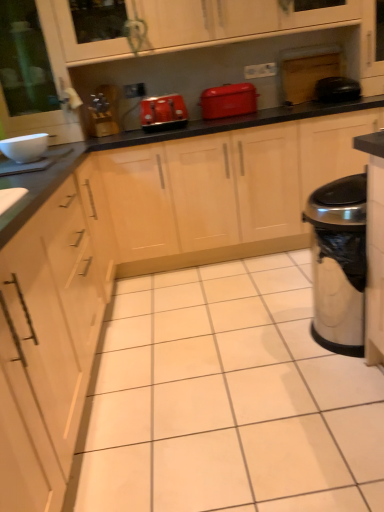
Question: Looking at their shapes, would you say matte wood cabinet at upper center is wider or thinner than black rubber trash can at right, positioned as the 2th appliance in left-to-right order?

Choices:
 (A) thin
 (B) wide

Answer: (B)

Question: Is point (314, 9) positioned closer to the camera than point (334, 96)?

Choices:
 (A) farther
 (B) closer

Answer: (B)

Question: Which object is positioned closest to the black rubber trash can at right, the first appliance viewed from the right?

Choices:
 (A) white glossy bowl at upper left, which appears as the second appliance when viewed from the back
 (B) black glossy countertop at center
 (C) silver metallic trash can at right
 (D) matte plastic toaster at center
 (E) matte wood cabinet at upper center

Answer: (B)

Question: Considering the real-world distances, which object is farthest from the matte wood cabinet at upper center?

Choices:
 (A) matte plastic toaster at center
 (B) matte red toaster at center
 (C) silver metallic trash can at right
 (D) white glossy bowl at upper left, which ranks as the second appliance in top-to-bottom order
 (E) black rubber trash can at right, positioned as the 2th appliance in left-to-right order

Answer: (C)